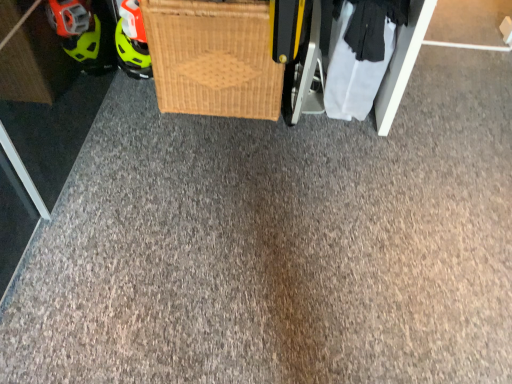
Question: Is white fabric at lower right to the left or to the right of woven wood basket at center in the image?

Choices:
 (A) right
 (B) left

Answer: (A)

Question: In the image, is white fabric at lower right positioned in front of or behind woven wood basket at center?

Choices:
 (A) front
 (B) behind

Answer: (B)

Question: Considering the positions of white fabric at lower right and woven wood basket at center in the image, is white fabric at lower right bigger or smaller than woven wood basket at center?

Choices:
 (A) small
 (B) big

Answer: (A)

Question: Visually, is woven wood basket at center positioned to the left or to the right of white fabric at lower right?

Choices:
 (A) right
 (B) left

Answer: (B)

Question: Looking at the image, does woven wood basket at center seem bigger or smaller compared to white fabric at lower right?

Choices:
 (A) small
 (B) big

Answer: (B)

Question: Is woven wood basket at center wider or thinner than white fabric at lower right?

Choices:
 (A) thin
 (B) wide

Answer: (B)

Question: From a real-world perspective, is woven wood basket at center physically located above or below white fabric at lower right?

Choices:
 (A) above
 (B) below

Answer: (A)